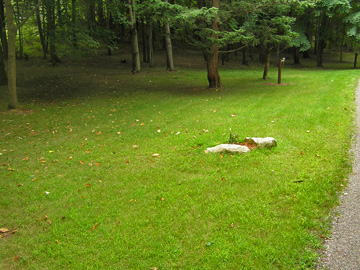
Where is `small green plant or baby tree`? small green plant or baby tree is located at coordinates (114, 48).